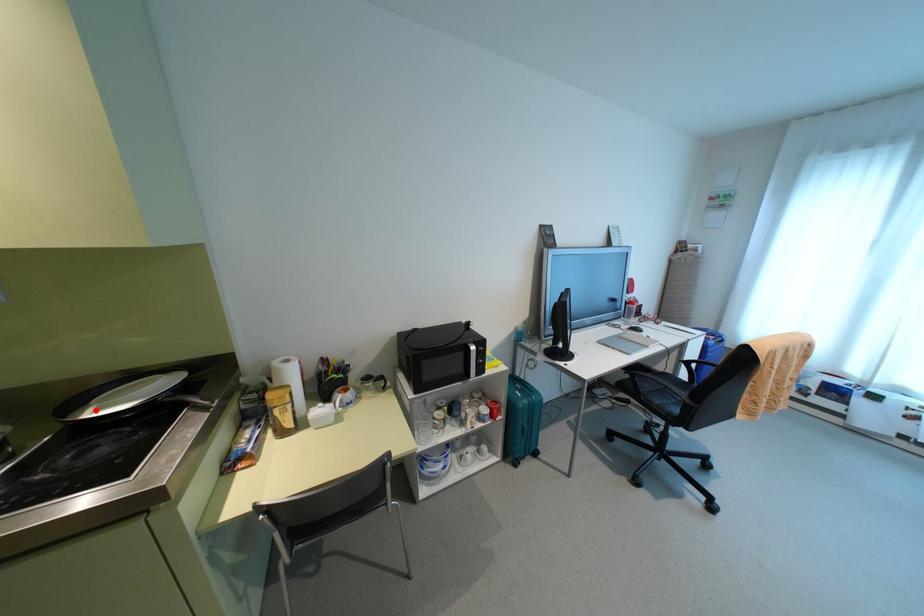
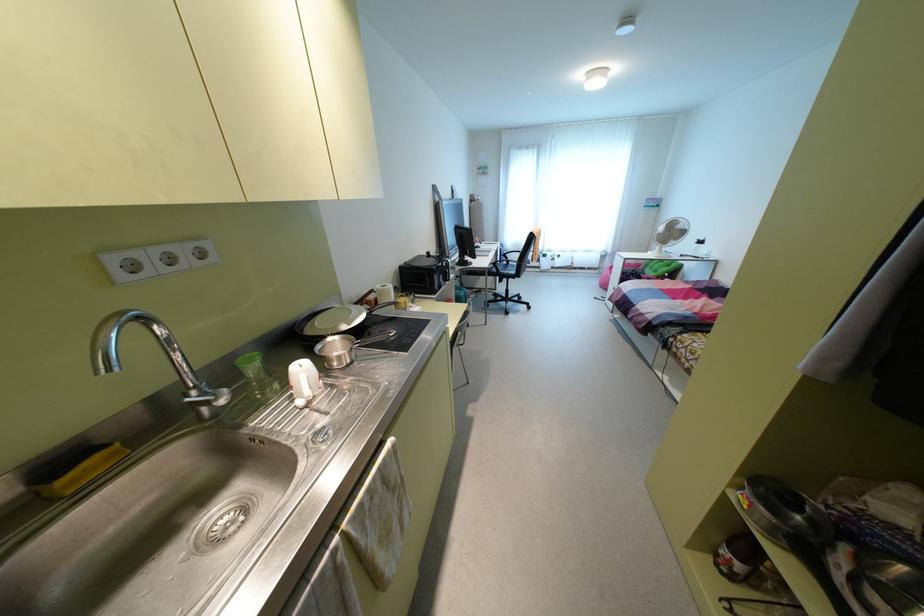
The point at the highlighted location is marked in the first image. Where is the corresponding point in the second image?

(348, 323)